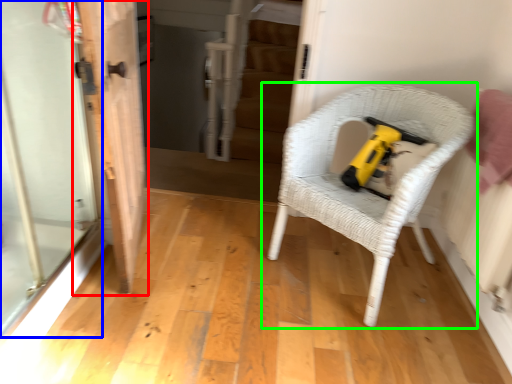
Question: Estimate the real-world distances between objects in this image. Which object is farther from door (highlighted by a red box), screen door (highlighted by a blue box) or chair (highlighted by a green box)?

Choices:
 (A) screen door
 (B) chair

Answer: (B)